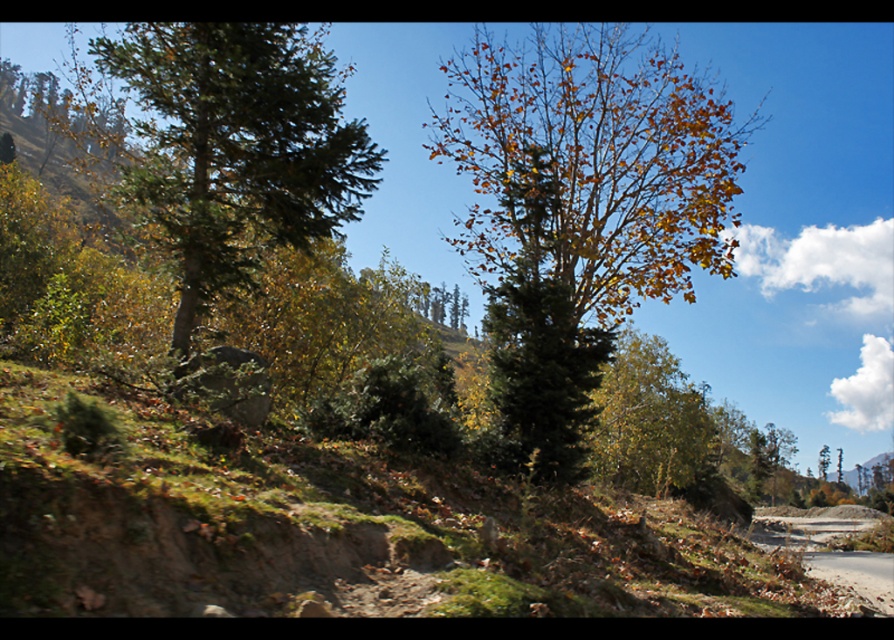
Is green matte tree at left to the right of dirt road at lower right from the viewer's perspective?

In fact, green matte tree at left is to the left of dirt road at lower right.

Which is more to the left, green matte tree at left or dirt road at lower right?

Positioned to the left is green matte tree at left.

Is point (221, 218) farther from viewer compared to point (783, 531)?

No, it is in front of (783, 531).

Locate an element on the screen. The image size is (894, 640). green matte tree at left is located at coordinates (232, 147).

Does yellow-green foliage at center have a larger size compared to dirt road at lower right?

Correct, yellow-green foliage at center is larger in size than dirt road at lower right.

Between point (452, 241) and point (850, 554), which one is positioned in front?

Point (452, 241)

Which is behind, point (569, 60) or point (852, 573)?

Positioned behind is point (569, 60).

This screenshot has width=894, height=640. I want to click on yellow-green foliage at center, so [x=580, y=211].

Does yellow-green foliage at center have a lesser height compared to green matte tree at left?

No, yellow-green foliage at center is not shorter than green matte tree at left.

Is point (663, 266) farther from camera compared to point (263, 52)?

Yes, point (663, 266) is farther from viewer.

Is point (702, 209) closer to viewer compared to point (255, 45)?

No, it is not.

The height and width of the screenshot is (640, 894). What are the coordinates of `yellow-green foliage at center` in the screenshot? It's located at (580, 211).